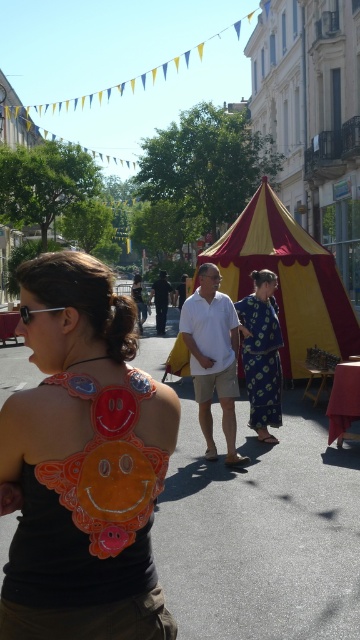
Describe the element at coordinates (83, 464) in the screenshot. I see `orange fabric smiley face at upper left` at that location.

Describe the element at coordinates (83, 464) in the screenshot. I see `orange fabric smiley face at upper left` at that location.

At what (x,y) coordinates should I click in order to perform the action: click on orange fabric smiley face at upper left. Please return your answer as a coordinate pair (x, y). Image resolution: width=360 pixels, height=640 pixels. Looking at the image, I should click on (83, 464).

Who is lower down, orange fabric smiley face at upper left or blue printed dress at center?

blue printed dress at center

Is orange fabric smiley face at upper left bigger than blue printed dress at center?

Incorrect, orange fabric smiley face at upper left is not larger than blue printed dress at center.

Identify the location of orange fabric smiley face at upper left. (83, 464).

Can you confirm if white cotton shirt at center is positioned below blue printed dress at center?

Indeed, white cotton shirt at center is positioned under blue printed dress at center.

Between point (227, 332) and point (271, 390), which one is positioned in front?

Point (227, 332) is in front.

Where is `white cotton shirt at center`? white cotton shirt at center is located at coordinates (213, 356).